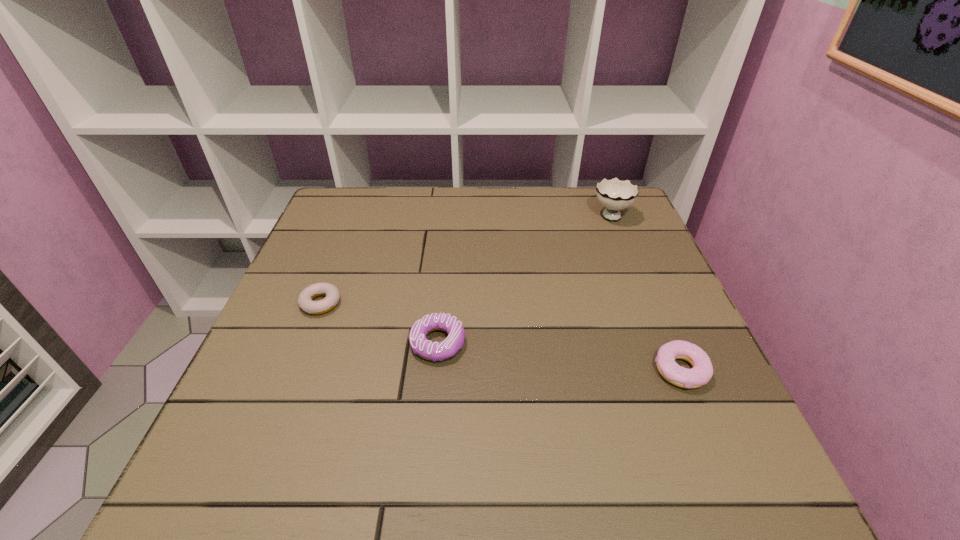
Where is `vacant space at the far right corner of the desktop`? vacant space at the far right corner of the desktop is located at coordinates (634, 221).

This screenshot has height=540, width=960. In order to click on vacant area that lies between the cup and the leftmost object in this screenshot , I will do `click(466, 258)`.

This screenshot has width=960, height=540. What are the coordinates of `free spot between the tallest object and the second object from left to right` in the screenshot? It's located at (524, 278).

Identify the location of empty space between the leftmost doughnut and the tallest object. The width and height of the screenshot is (960, 540). (466, 258).

This screenshot has width=960, height=540. I want to click on vacant space that is in between the second doughnut from right to left and the cup, so click(x=524, y=278).

This screenshot has width=960, height=540. I want to click on unoccupied position between the tallest object and the second doughnut from left to right, so click(x=524, y=278).

Image resolution: width=960 pixels, height=540 pixels. I want to click on unoccupied area between the shortest object and the rightmost doughnut, so click(501, 336).

Find the location of a particular element. Image resolution: width=960 pixels, height=540 pixels. vacant area that lies between the rightmost doughnut and the leftmost doughnut is located at coordinates (501, 336).

In order to click on vacant area between the second farthest object and the rightmost doughnut in this screenshot , I will do `click(501, 336)`.

The image size is (960, 540). In order to click on vacant point located between the farthest object and the second doughnut from left to right in this screenshot , I will do `click(524, 278)`.